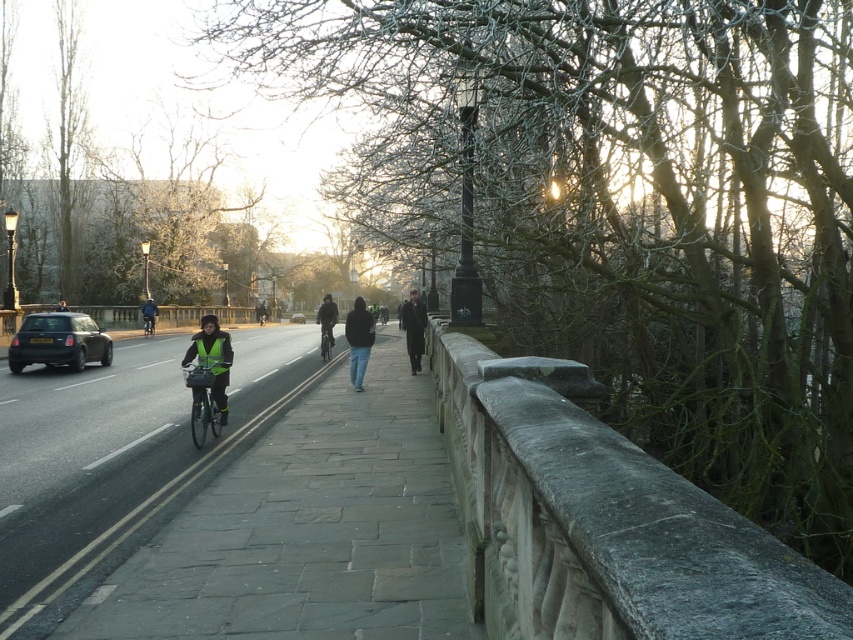
Is matte black car at center positioned behind reflective silver helmet at center?

Yes, it is behind reflective silver helmet at center.

In the scene shown: Does matte black car at center have a smaller size compared to reflective silver helmet at center?

Correct, matte black car at center occupies less space than reflective silver helmet at center.

Is point (291, 316) less distant than point (65, 301)?

No.

Where is `matte black car at center`? matte black car at center is located at coordinates (297, 317).

Between point (218, 342) and point (332, 344), which one is positioned behind?

The point (332, 344) is more distant.

Does neon yellow reflective vest at center have a greater width compared to dark gray jacket at center?

In fact, neon yellow reflective vest at center might be narrower than dark gray jacket at center.

Measure the distance between point (x=215, y=356) and camera.

Point (x=215, y=356) is 36.81 feet away from camera.

The width and height of the screenshot is (853, 640). In order to click on neon yellow reflective vest at center in this screenshot , I will do `click(212, 358)`.

Between point (225, 401) and point (61, 304), which one is positioned in front?

Point (225, 401) is in front.

Who is positioned more to the right, neon yellow reflective vest at center or reflective silver helmet at center?

neon yellow reflective vest at center

Who is more forward, (204,365) or (62,307)?

Point (204,365) is more forward.

I want to click on neon yellow reflective vest at center, so click(x=212, y=358).